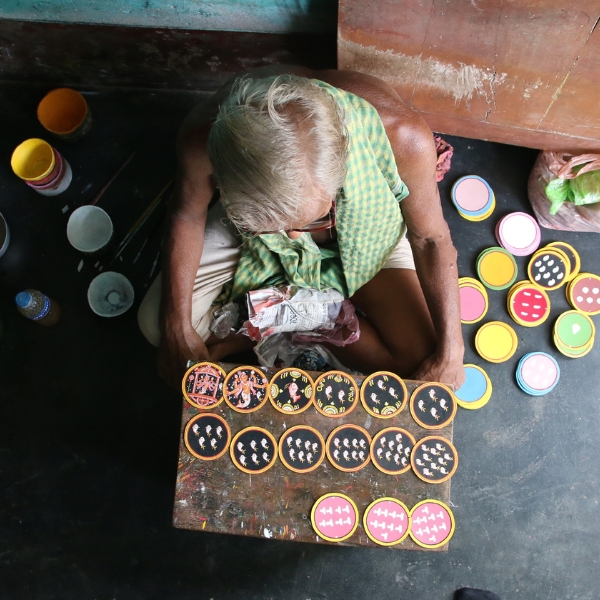
The height and width of the screenshot is (600, 600). What are the coordinates of `three pink circles on table` in the screenshot? It's located at (340, 522), (391, 534), (431, 523).